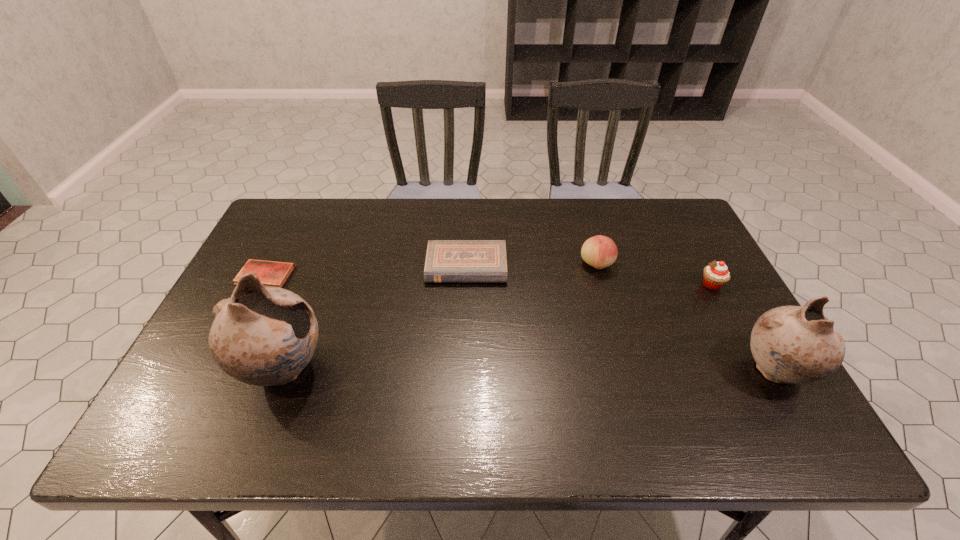
Identify the location of the tallest object. This screenshot has height=540, width=960. (263, 336).

The width and height of the screenshot is (960, 540). I want to click on the left pottery, so click(263, 336).

This screenshot has width=960, height=540. I want to click on the shorter pottery, so click(790, 344).

Where is `the fifth shortest object`? This screenshot has height=540, width=960. the fifth shortest object is located at coordinates tap(790, 344).

Image resolution: width=960 pixels, height=540 pixels. Find the location of `the third object from right to left`. the third object from right to left is located at coordinates (599, 251).

Identify the location of cupcake. The image size is (960, 540). (716, 274).

The width and height of the screenshot is (960, 540). What are the coordinates of `the fourth object from right to left` in the screenshot? It's located at (447, 261).

Where is `the fifth tallest object`? This screenshot has height=540, width=960. the fifth tallest object is located at coordinates (447, 261).

You are a GUI agent. You are given a task and a screenshot of the screen. Output one action in this format:
    pyautogui.click(x=<x>, y=<y>)
    Task: Click on the diary
    
    Given the screenshot: What is the action you would take?
    pyautogui.click(x=270, y=273)

Locate an element on the screen. vacant space situated 0.200m from the spout of the tallest object is located at coordinates (414, 369).